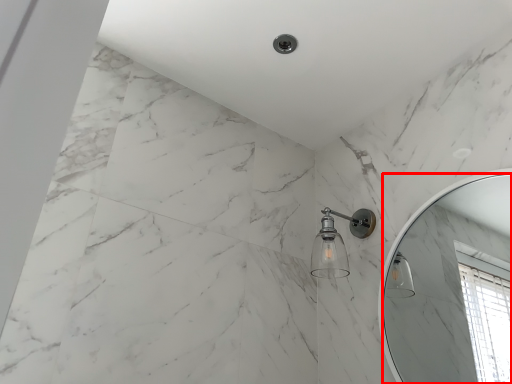
Question: From the image's perspective, what is the correct spatial positioning of mirror (annotated by the red box) in reference to shower?

Choices:
 (A) below
 (B) above

Answer: (A)